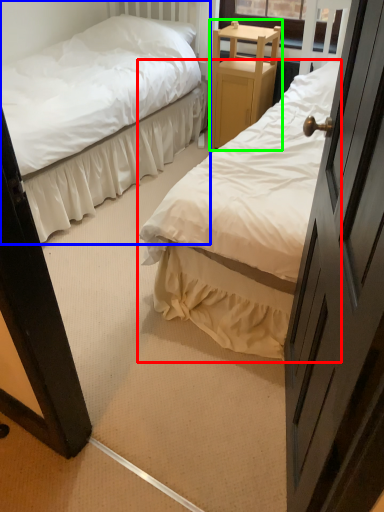
Question: Which object is the farthest from bed (highlighted by a red box)? Choose among these: bed (highlighted by a blue box) or furniture (highlighted by a green box).

Choices:
 (A) bed
 (B) furniture

Answer: (A)